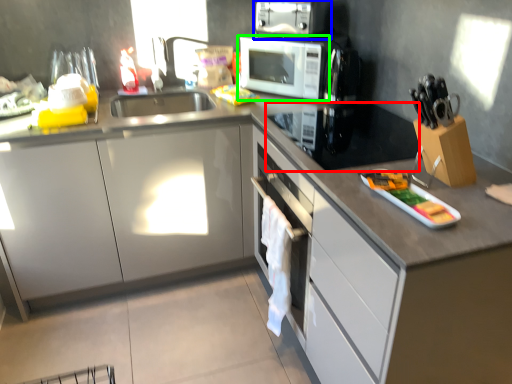
Question: Considering the real-world distances, which object is farthest from appliance (highlighted by a red box)? kitchen appliance (highlighted by a blue box) or home appliance (highlighted by a green box)?

Choices:
 (A) kitchen appliance
 (B) home appliance

Answer: (A)